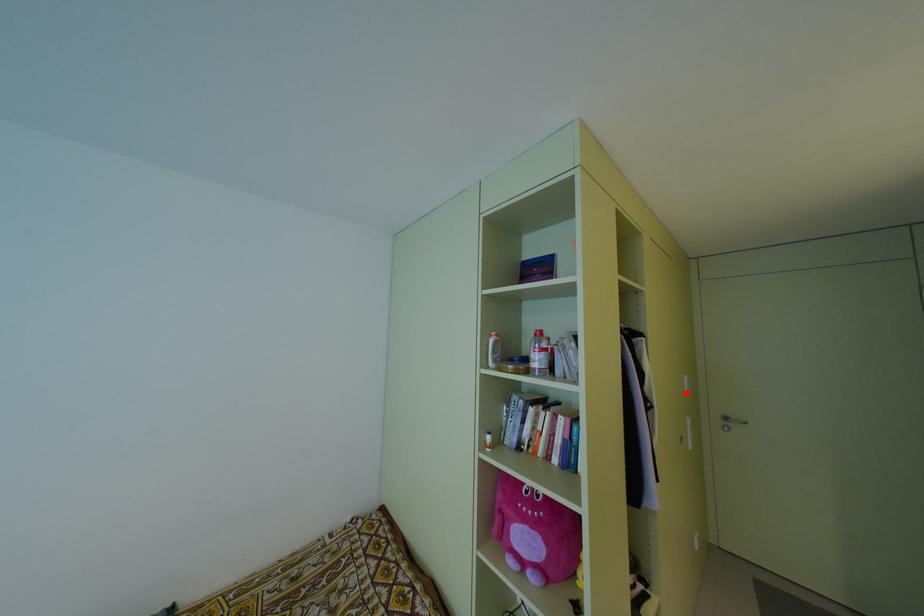
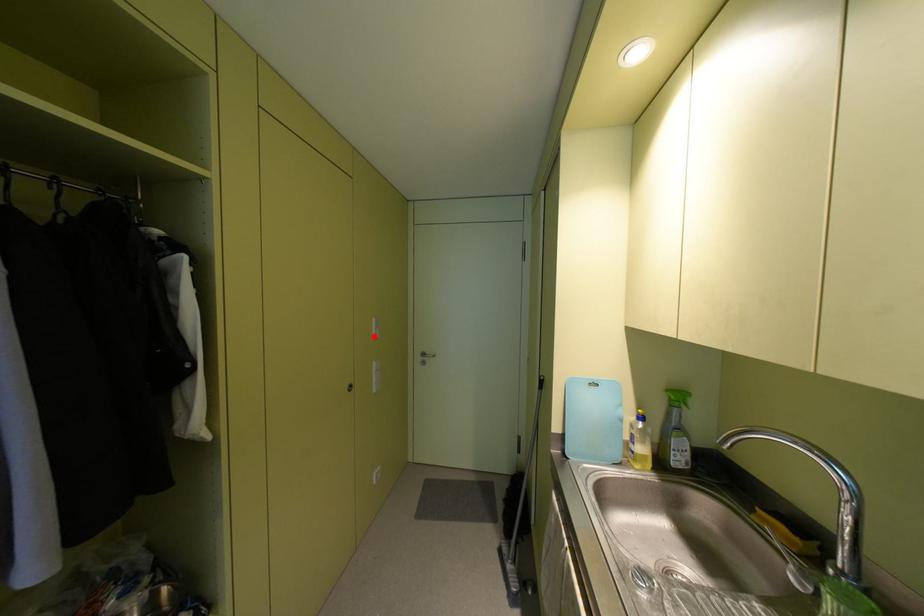
I am providing you with two images of the same scene from different viewpoints. A red point is marked on the first image and another point is marked on the second image. Is the marked point in image1 the same physical position as the marked point in image2?

→ Yes